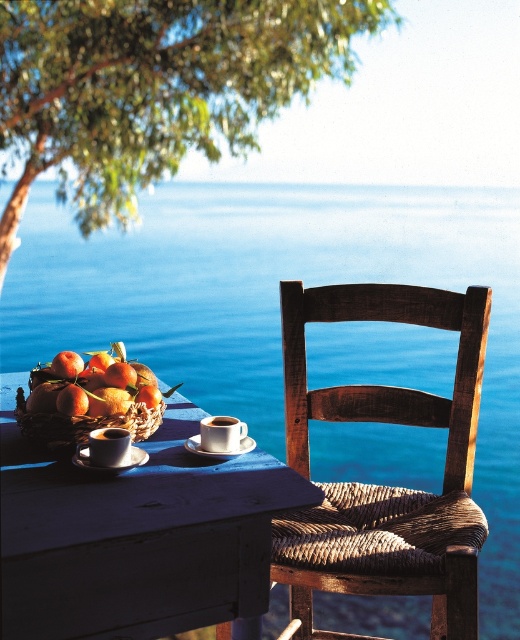
Does green leafy tree at upper left have a greater width compared to white ceramic saucer at center?

Yes.

Can you confirm if green leafy tree at upper left is taller than white ceramic saucer at center?

Indeed, green leafy tree at upper left has a greater height compared to white ceramic saucer at center.

Who is more forward, (x=275, y=106) or (x=196, y=445)?

Point (x=196, y=445)

What are the coordinates of `green leafy tree at upper left` in the screenshot? It's located at (x=153, y=88).

Which is more to the left, matte ceramic cup at table left or white ceramic saucer at lower left?

Positioned to the left is matte ceramic cup at table left.

Is matte ceramic cup at table left bigger than white ceramic saucer at lower left?

Yes, matte ceramic cup at table left is bigger than white ceramic saucer at lower left.

Is point (89, 442) farther from camera compared to point (133, 461)?

No.

Find the location of a particular element. The image size is (520, 640). matte ceramic cup at table left is located at coordinates (106, 448).

At what (x,y) coordinates should I click in order to perform the action: click on matte ceramic cup at table left. Please return your answer as a coordinate pair (x, y). Looking at the image, I should click on (106, 448).

Is point (91, 451) positioned before point (201, 452)?

Yes, point (91, 451) is closer to viewer.

Who is more forward, [126,451] or [196,451]?

Point [126,451]

Locate an element on the screen. matte ceramic cup at table left is located at coordinates (106, 448).